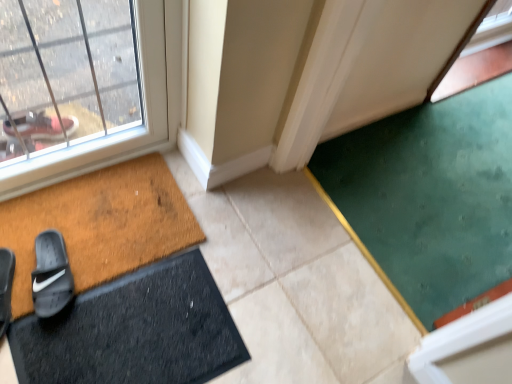
Question: Does black rubber slide at lower left, positioned as the first footwear in right-to-left order, appear on the right side of black suede slide at lower left, the 1th footwear viewed from the left?

Choices:
 (A) no
 (B) yes

Answer: (B)

Question: Can you confirm if black rubber slide at lower left, positioned as the first footwear in right-to-left order, is bigger than black suede slide at lower left, the 1th footwear viewed from the left?

Choices:
 (A) no
 (B) yes

Answer: (B)

Question: Considering the relative positions of black rubber slide at lower left, which is the second footwear in left-to-right order, and black suede slide at lower left, the 1th footwear viewed from the left, in the image provided, is black rubber slide at lower left, which is the second footwear in left-to-right order, to the left of black suede slide at lower left, the 1th footwear viewed from the left, from the viewer's perspective?

Choices:
 (A) yes
 (B) no

Answer: (B)

Question: Does black rubber slide at lower left, positioned as the first footwear in right-to-left order, have a lesser width compared to black suede slide at lower left, acting as the second footwear starting from the right?

Choices:
 (A) yes
 (B) no

Answer: (A)

Question: Is black suede slide at lower left, the 1th footwear viewed from the left, surrounded by black rubber slide at lower left, positioned as the first footwear in right-to-left order?

Choices:
 (A) yes
 (B) no

Answer: (B)

Question: Considering their positions, is black suede slide at lower left, acting as the second footwear starting from the right, located in front of or behind brown textured doormat at lower left, which appears as the 1th bath mat when viewed from the top?

Choices:
 (A) behind
 (B) front

Answer: (B)

Question: Is point (6, 321) closer or farther from the camera than point (30, 269)?

Choices:
 (A) farther
 (B) closer

Answer: (B)

Question: From the image's perspective, is black suede slide at lower left, the 1th footwear viewed from the left, located above or below brown textured doormat at lower left, which appears as the 1th bath mat when viewed from the top?

Choices:
 (A) above
 (B) below

Answer: (B)

Question: Based on their positions, is black suede slide at lower left, acting as the second footwear starting from the right, located to the left or right of brown textured doormat at lower left, which appears as the 1th bath mat when viewed from the top?

Choices:
 (A) right
 (B) left

Answer: (B)

Question: From their relative heights in the image, would you say black rubber bath mat at lower left, positioned as the first bath mat in bottom-to-top order, is taller or shorter than green carpet at lower right?

Choices:
 (A) short
 (B) tall

Answer: (A)

Question: Looking at the image, does black rubber bath mat at lower left, positioned as the first bath mat in bottom-to-top order, seem bigger or smaller compared to green carpet at lower right?

Choices:
 (A) big
 (B) small

Answer: (B)

Question: From the image's perspective, is black rubber bath mat at lower left, which is the second bath mat in top-to-bottom order, located above or below green carpet at lower right?

Choices:
 (A) below
 (B) above

Answer: (A)

Question: Considering the positions of point (96, 372) and point (382, 130), is point (96, 372) closer or farther from the camera than point (382, 130)?

Choices:
 (A) closer
 (B) farther

Answer: (A)

Question: Considering their positions, is black suede slide at lower left, acting as the second footwear starting from the right, located in front of or behind black rubber slide at lower left, which is the second footwear in left-to-right order?

Choices:
 (A) front
 (B) behind

Answer: (A)

Question: Do you think black suede slide at lower left, the 1th footwear viewed from the left, is within black rubber slide at lower left, which is the second footwear in left-to-right order, or outside of it?

Choices:
 (A) outside
 (B) inside

Answer: (A)